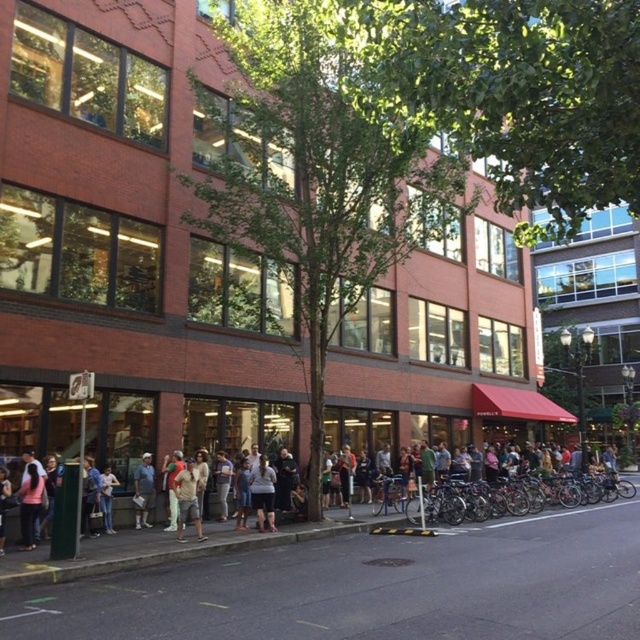
Question: Which of the following is the farthest from the observer?

Choices:
 (A) (204, 528)
 (B) (196, 518)

Answer: (A)

Question: Can you confirm if light brown cotton shirt at center is thinner than light blue denim shorts at center?

Choices:
 (A) no
 (B) yes

Answer: (A)

Question: Which of the following is the farthest from the observer?

Choices:
 (A) light blue denim shorts at center
 (B) black asphalt pavement at lower center
 (C) light brown cotton shirt at center

Answer: (A)

Question: Does light brown cotton shirt at center lie in front of light blue denim shorts at center?

Choices:
 (A) yes
 (B) no

Answer: (A)

Question: Is dark gray fabric shirt at center to the left of light blue denim shorts at center from the viewer's perspective?

Choices:
 (A) no
 (B) yes

Answer: (A)

Question: Which point is closer to the camera?

Choices:
 (A) pink fabric shirt at lower left
 (B) black asphalt pavement at lower center
 (C) light brown cotton shirt at center

Answer: (B)